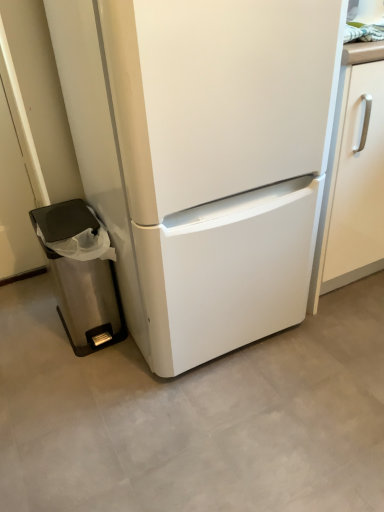
Image resolution: width=384 pixels, height=512 pixels. I want to click on free space in front of stainless steel trash can at left, so click(83, 385).